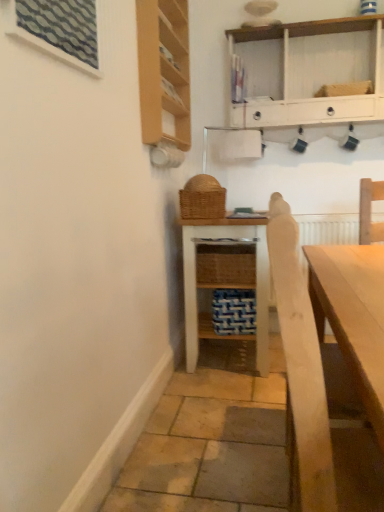
This screenshot has height=512, width=384. Find the location of `free point above white painted wood shelf at upper center, arranged as the first shelf when viewed from the top (from a real-world perspective)`. free point above white painted wood shelf at upper center, arranged as the first shelf when viewed from the top (from a real-world perspective) is located at coordinates (312, 24).